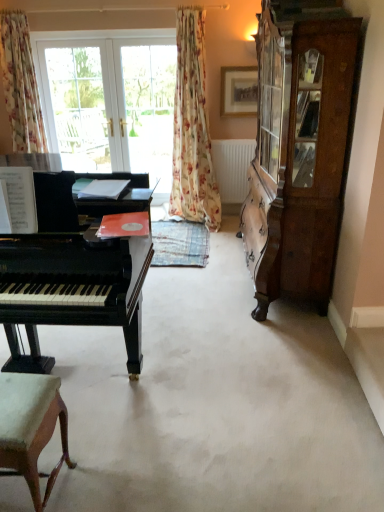
In order to click on free space in front of wooden cabinet at right in this screenshot , I will do `click(261, 361)`.